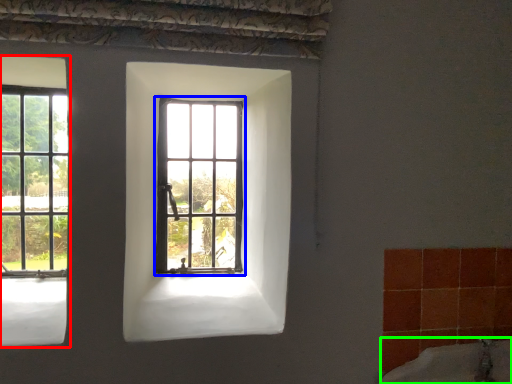
Question: Which object is positioned closest to window (highlighted by a red box)? Select from window (highlighted by a blue box) and bath (highlighted by a green box).

Choices:
 (A) window
 (B) bath

Answer: (A)